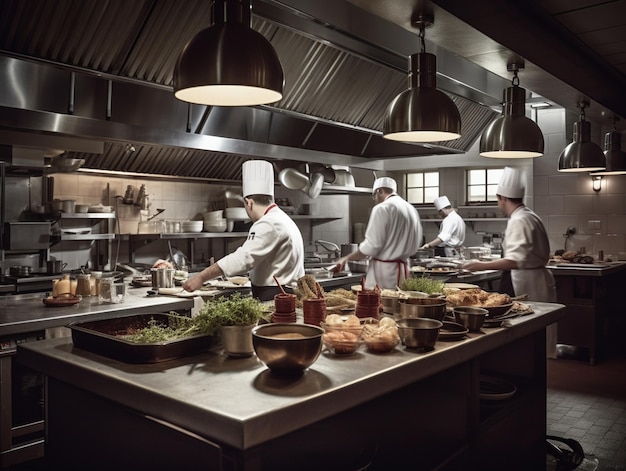
The height and width of the screenshot is (471, 626). Identify the location of stack of plates. (193, 226).